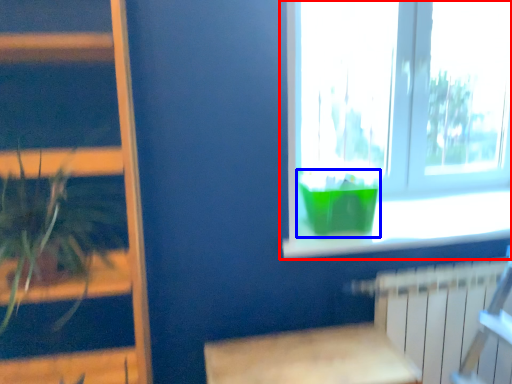
Question: Which of the following is the farthest to the observer, window (highlighted by a red box) or glass vase (highlighted by a blue box)?

Choices:
 (A) window
 (B) glass vase

Answer: (A)